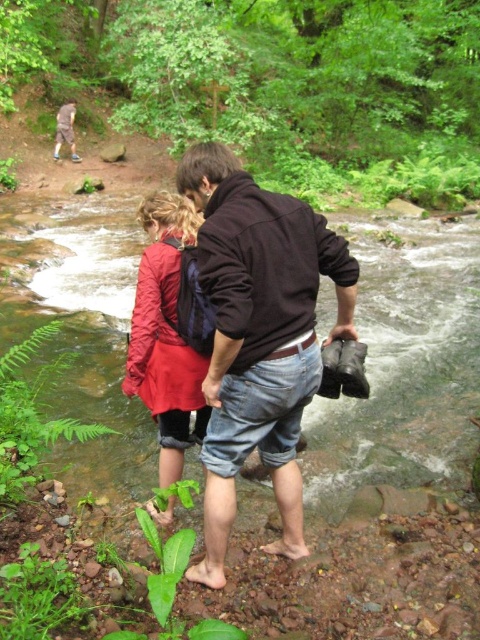
You are standing at the point marked as point [166,336] in the image. What object is located exactly at this point?

The matte red jacket at center is located exactly at point [166,336].

You are planning to cross the clear water stream at center while carrying the brown leather jacket at upper left. Given the stream is wider than the jacket, can you safely step across without getting your feet wet?

The clear water stream at center is wider than the brown leather jacket at upper left, so you cannot safely step across using the jacket to bridge the gap. You will likely get your feet wet.